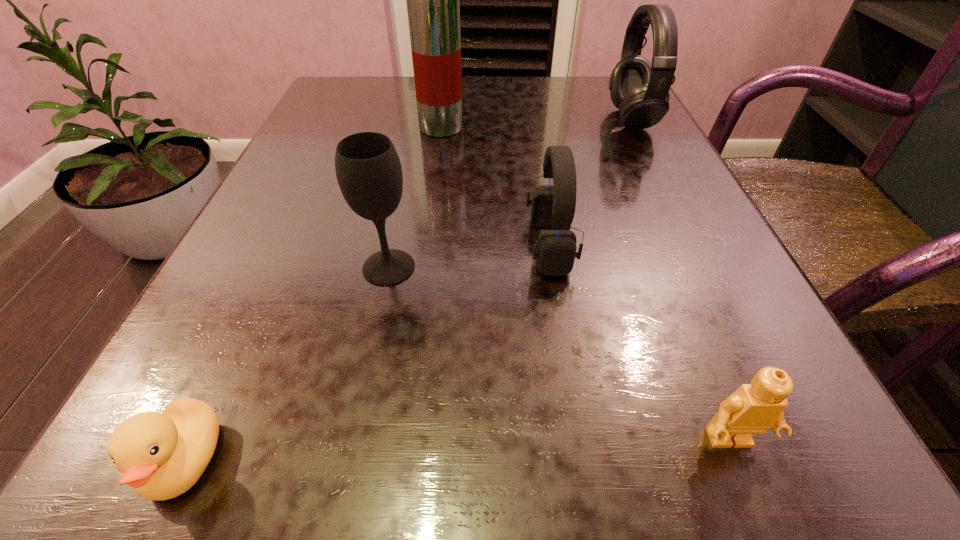
The height and width of the screenshot is (540, 960). In order to click on vacant space situated on the earcups of the farther headset in this screenshot , I will do `click(512, 119)`.

Find the location of `vacant point located 0.310m on the earcups of the farther headset`. vacant point located 0.310m on the earcups of the farther headset is located at coordinates (458, 119).

I want to click on vacant region located on the earcups of the farther headset, so click(488, 119).

Where is `free region located 0.360m on the back of the wineglass`? free region located 0.360m on the back of the wineglass is located at coordinates (418, 126).

Image resolution: width=960 pixels, height=540 pixels. I want to click on vacant space positioned 0.360m on the headband of the left headset, so click(x=275, y=245).

Locate an element on the screen. vacant space located on the headband of the left headset is located at coordinates (331, 245).

In order to click on free space located on the headband of the left headset in this screenshot , I will do `click(394, 245)`.

Identify the location of liquor at the far edge. Image resolution: width=960 pixels, height=540 pixels. [x=433, y=0].

Where is `headset that is at the far edge`? headset that is at the far edge is located at coordinates (640, 90).

Where is `Lego located at the near edge`? Lego located at the near edge is located at coordinates (753, 408).